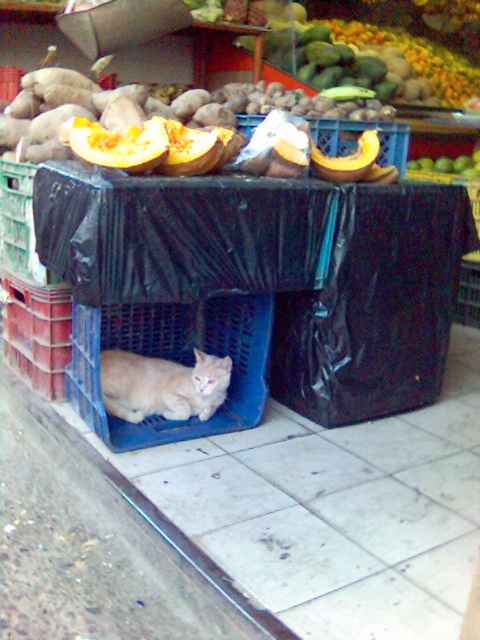
Question: Estimate the real-world distances between objects in this image. Which object is closer to the orange smooth pumpkin at center?

Choices:
 (A) green matte apple at upper center
 (B) orange fleshed squash at center
 (C) light orange fur cat at center

Answer: (B)

Question: Does orange fleshed squash at center lie in front of green matte apple at upper center?

Choices:
 (A) no
 (B) yes

Answer: (B)

Question: Can you confirm if blue plastic crate at center is positioned to the right of yellow matte pumpkin at center?

Choices:
 (A) no
 (B) yes

Answer: (A)

Question: Which point is closer to the camera?

Choices:
 (A) (202, 387)
 (B) (225, 404)
 (C) (409, 176)

Answer: (A)

Question: Can you confirm if orange fleshed squash at center is positioned below orange smooth pumpkin at center?

Choices:
 (A) yes
 (B) no

Answer: (A)

Question: Which of the following is the farthest from the observer?

Choices:
 (A) orange smooth pumpkin at center
 (B) blue plastic crate at center

Answer: (A)